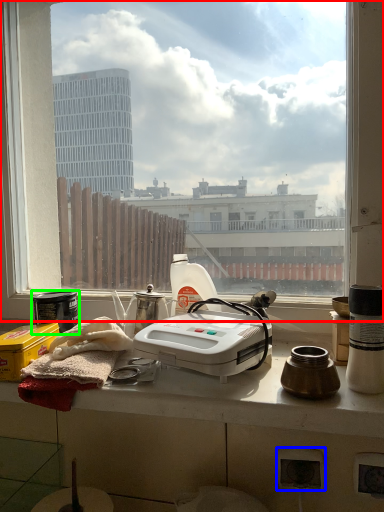
Question: Considering the real-world distances, which object is closest to window (highlighted by a red box)? power plugs and sockets (highlighted by a blue box) or appliance (highlighted by a green box).

Choices:
 (A) power plugs and sockets
 (B) appliance

Answer: (B)